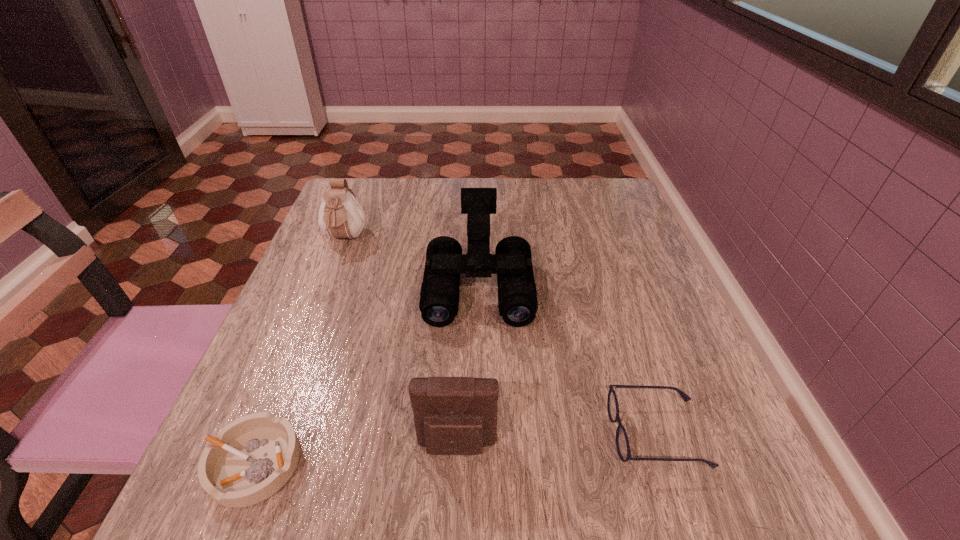
Locate an element on the screen. object positioned at the near right corner is located at coordinates (622, 443).

Locate an element on the screen. The image size is (960, 540). free space at the far edge is located at coordinates (447, 187).

The image size is (960, 540). Identify the location of free spot at the near edge of the desktop. (335, 474).

Locate an element on the screen. vacant area at the left edge is located at coordinates (342, 375).

Identify the location of free point at the right edge. (588, 234).

In order to click on free space at the far right corner of the desktop in this screenshot , I will do `click(602, 224)`.

The width and height of the screenshot is (960, 540). Identify the location of vacant region at the near right corner. (751, 482).

Locate an element on the screen. free space between the nearer pouch and the binoculars is located at coordinates (468, 366).

In order to click on vacant space in between the binoculars and the right pouch in this screenshot , I will do `click(468, 366)`.

I want to click on vacant region between the spectacles and the binoculars, so click(x=568, y=359).